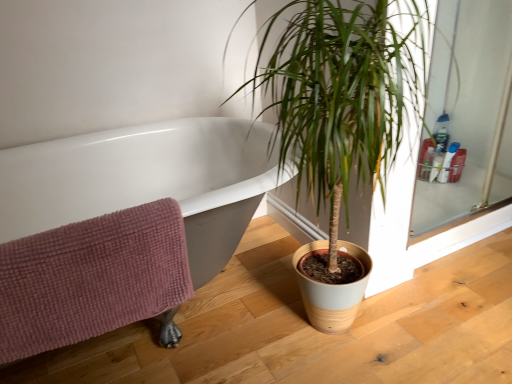
The height and width of the screenshot is (384, 512). What are the coordinates of `free spot in front of translucent plastic bottles at upper right, positioned as the second toiletry in left-to-right order` in the screenshot? It's located at (453, 193).